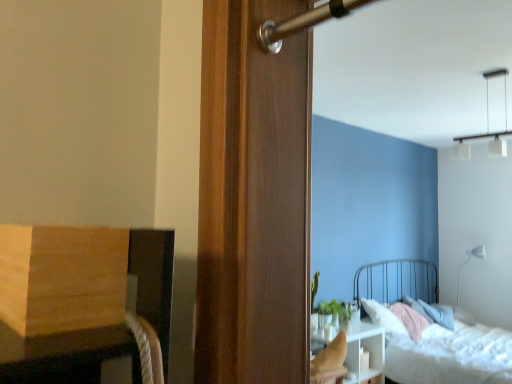
Question: Considering the relative positions of white matte floor lamp at upper right, which is counted as the 2th light fixture, starting from the left, and white glass pendant lights at upper right, which is the second light fixture from bottom to top, in the image provided, is white matte floor lamp at upper right, which is counted as the 2th light fixture, starting from the left, to the left or to the right of white glass pendant lights at upper right, which is the second light fixture from bottom to top,?

Choices:
 (A) left
 (B) right

Answer: (B)

Question: In terms of height, does white matte floor lamp at upper right, the 2th light fixture positioned from the front, look taller or shorter compared to white glass pendant lights at upper right, which appears as the second light fixture when viewed from the back?

Choices:
 (A) short
 (B) tall

Answer: (B)

Question: Estimate the real-world distances between objects in this image. Which object is farther from the white textured bed at lower right?

Choices:
 (A) white glass pendant lights at upper right, which appears as the second light fixture when viewed from the back
 (B) white matte floor lamp at upper right, the 2th light fixture positioned from the front
 (C) white glossy nightstand at lower right
 (D) green matte plant at center

Answer: (A)

Question: Based on their relative distances, which object is nearer to the white glass pendant lights at upper right, which appears as the second light fixture when viewed from the back?

Choices:
 (A) white matte floor lamp at upper right, the first light fixture when ordered from back to front
 (B) white textured bed at lower right
 (C) white glossy nightstand at lower right
 (D) green matte plant at center

Answer: (D)